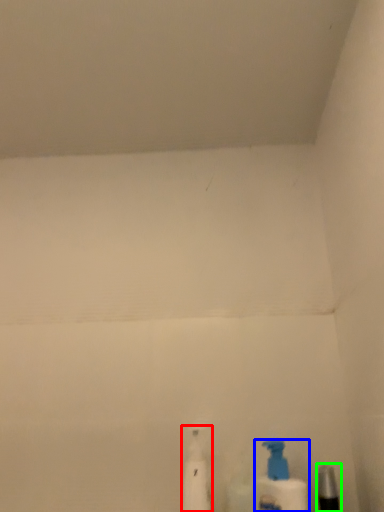
Question: Which is nearer to the cleaning product (highlighted by a red box)? bottle (highlighted by a blue box) or toiletry (highlighted by a green box).

Choices:
 (A) bottle
 (B) toiletry

Answer: (A)